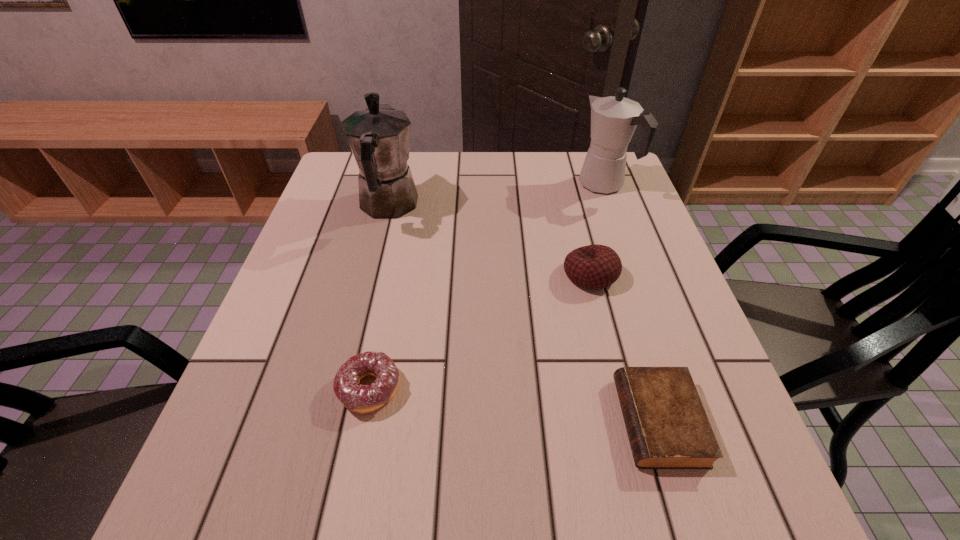
Identify the location of free spot between the second shortest object and the right coffeepot. (488, 287).

Locate an element on the screen. This screenshot has height=540, width=960. free space between the right coffeepot and the diary is located at coordinates (632, 303).

The width and height of the screenshot is (960, 540). I want to click on vacant space in between the right coffeepot and the shortest object, so click(632, 303).

The image size is (960, 540). In order to click on free space between the left coffeepot and the shortest object in this screenshot , I will do `click(523, 314)`.

This screenshot has width=960, height=540. What are the coordinates of `empty location between the right coffeepot and the third shortest object` in the screenshot? It's located at (598, 230).

What are the coordinates of `vacant space in between the third nearest object and the right coffeepot` in the screenshot? It's located at (598, 230).

Locate an element on the screen. This screenshot has width=960, height=540. empty space that is in between the diary and the right coffeepot is located at coordinates (632, 303).

The width and height of the screenshot is (960, 540). I want to click on unoccupied area between the shortest object and the left coffeepot, so click(x=523, y=314).

Find the location of `object that stands as the second closest to the diary`. object that stands as the second closest to the diary is located at coordinates (358, 398).

At what (x,y) coordinates should I click in order to perform the action: click on the third closest object to the third farthest object. Please return your answer as a coordinate pair (x, y). The height and width of the screenshot is (540, 960). Looking at the image, I should click on (379, 137).